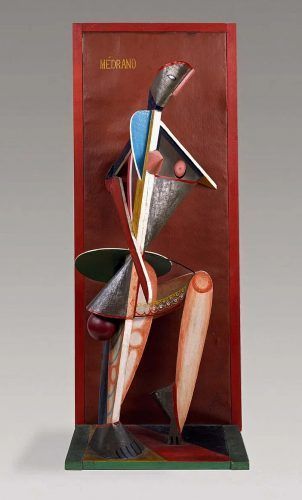
This screenshot has width=302, height=500. I want to click on blue cloth, so click(138, 131).